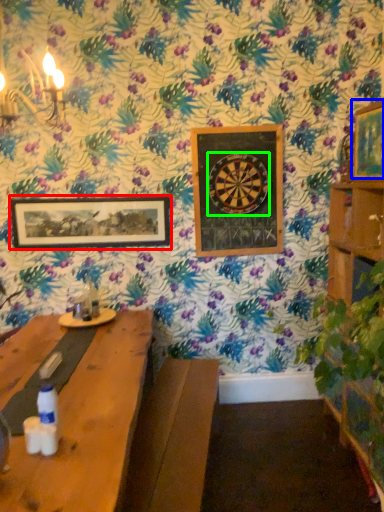
Question: Which is nearer to the picture frame (highlighted by a red box)? picture frame (highlighted by a blue box) or design (highlighted by a green box).

Choices:
 (A) picture frame
 (B) design

Answer: (B)